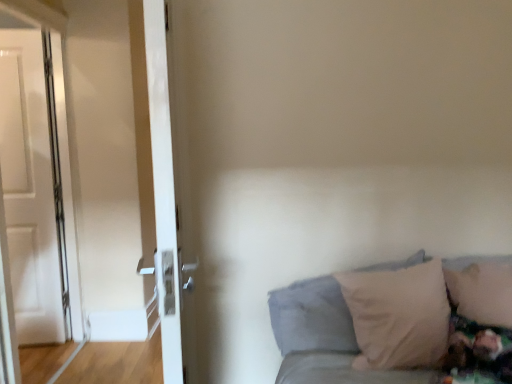
Question: Is beige soft pillow at lower right, which is the first pillow from right to left, situated inside white glossy door at left, the second door from the right, or outside?

Choices:
 (A) outside
 (B) inside

Answer: (A)

Question: Is beige soft pillow at lower right, the second pillow positioned from the left, bigger or smaller than white glossy door at left, the second door from the right?

Choices:
 (A) big
 (B) small

Answer: (A)

Question: Estimate the real-world distances between objects in this image. Which object is closer to the white glossy door at left, the first door viewed from the left?

Choices:
 (A) white glossy door at left, the 2th door when ordered from left to right
 (B) soft beige pillow at lower right, positioned as the first pillow in left-to-right order
 (C) beige soft pillow at lower right, which is the first pillow from right to left

Answer: (B)

Question: Estimate the real-world distances between objects in this image. Which object is farther from the white glossy door at left, the 1th door viewed from the back?

Choices:
 (A) white glossy door at left, the 2th door when ordered from left to right
 (B) soft beige pillow at lower right, which appears as the second pillow when viewed from the right
 (C) beige soft pillow at lower right, the second pillow positioned from the left

Answer: (C)